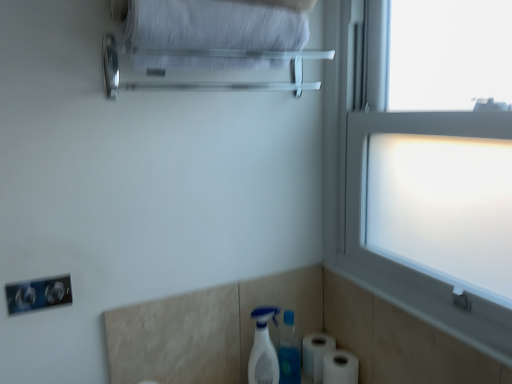
Question: Considering the positions of point (303, 370) and point (263, 319), is point (303, 370) closer or farther from the camera than point (263, 319)?

Choices:
 (A) closer
 (B) farther

Answer: (B)

Question: Considering the positions of white matte toilet paper at lower right, the 1th toilet paper viewed from the back, and white plastic spray bottle at lower center in the image, is white matte toilet paper at lower right, the 1th toilet paper viewed from the back, wider or thinner than white plastic spray bottle at lower center?

Choices:
 (A) wide
 (B) thin

Answer: (A)

Question: Considering the real-world distances, which object is closest to the white matte toilet paper at lower right, which appears as the second toilet paper when viewed from the back?

Choices:
 (A) white matte toilet paper at lower right, positioned as the 2th toilet paper in front-to-back order
 (B) frosted glass window at right
 (C) satin silver towel bar at upper center
 (D) white plastic spray bottle at lower center
 (E) white fabric bath towel at upper center

Answer: (A)

Question: Considering the real-world distances, which object is farthest from the frosted glass window at right?

Choices:
 (A) satin silver towel bar at upper center
 (B) white matte toilet paper at lower right, the 1th toilet paper viewed from the back
 (C) white matte toilet paper at lower right, the first toilet paper when ordered from front to back
 (D) white fabric bath towel at upper center
 (E) white plastic spray bottle at lower center

Answer: (C)